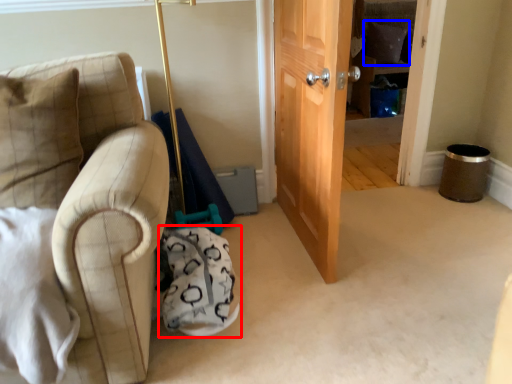
Question: Among these objects, which one is nearest to the camera, swivel chair (highlighted by a red box) or pillow (highlighted by a blue box)?

Choices:
 (A) swivel chair
 (B) pillow

Answer: (A)